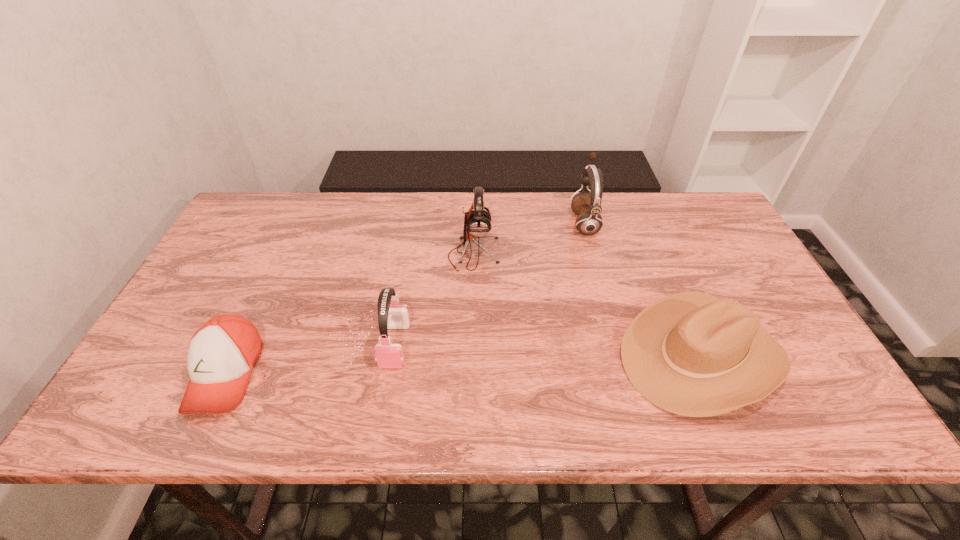
Where is `free area in between the fourth tallest object and the third object from left to right`? This screenshot has height=540, width=960. free area in between the fourth tallest object and the third object from left to right is located at coordinates (588, 305).

This screenshot has height=540, width=960. Identify the location of free space between the cowboy hat and the baseball cap. (464, 364).

I want to click on empty location between the rightmost earphone and the cowboy hat, so click(x=642, y=289).

Find the location of a particular element. This screenshot has height=540, width=960. vacant space that is in between the second shortest object and the shortest earphone is located at coordinates (548, 350).

Where is `free space between the third object from left to right and the rightmost earphone`? The width and height of the screenshot is (960, 540). free space between the third object from left to right and the rightmost earphone is located at coordinates (529, 238).

You are a GUI agent. You are given a task and a screenshot of the screen. Output one action in this format:
    pyautogui.click(x=<x>, y=<y>)
    Task: Click on the object that stands as the closest to the cowboy hat
    The image size is (960, 540).
    Given the screenshot: What is the action you would take?
    pyautogui.click(x=587, y=205)

You are a GUI agent. You are given a task and a screenshot of the screen. Output one action in this format:
    pyautogui.click(x=<x>, y=<y>)
    Task: Click on the object that is the second closest to the cowboy hat
    The image size is (960, 540).
    Given the screenshot: What is the action you would take?
    pyautogui.click(x=477, y=223)

In order to click on the closest earphone to the second earphone from right to left in this screenshot , I will do `click(388, 355)`.

Find the location of a particular element. This screenshot has width=960, height=540. earphone that is the second closest to the shortest earphone is located at coordinates (587, 205).

You are a GUI agent. You are given a task and a screenshot of the screen. Output one action in this format:
    pyautogui.click(x=<x>, y=<y>)
    Task: Click on the blank area in the image that satisfies the following two spatial constraints: 1. on the ear pads of the rightmost earphone; 2. on the front-facing side of the shortest object
    The height and width of the screenshot is (540, 960).
    Given the screenshot: What is the action you would take?
    pyautogui.click(x=625, y=374)